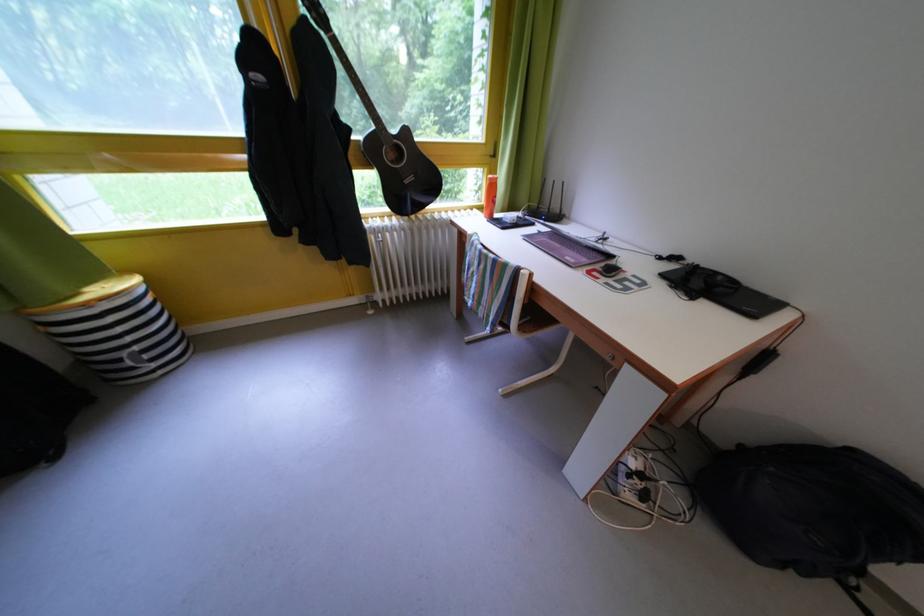
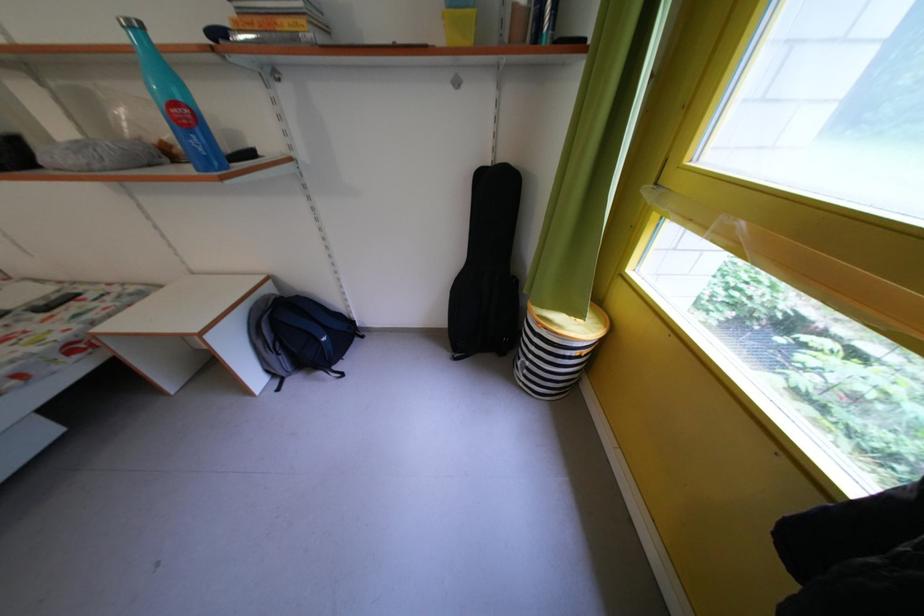
Locate, in the second image, the point that corresponds to pixel 147 354 in the first image.

(537, 369)